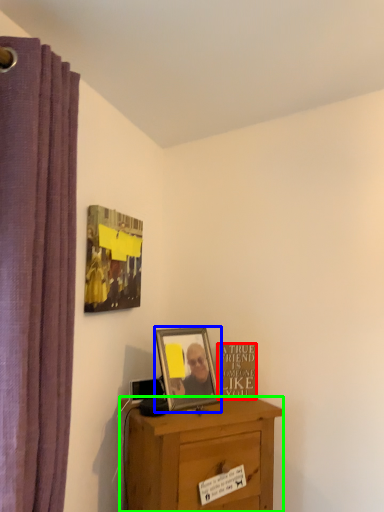
Question: Estimate the real-world distances between objects in this image. Which object is farther from writing (highlighted by a red box), picture frame (highlighted by a blue box) or desk (highlighted by a green box)?

Choices:
 (A) picture frame
 (B) desk

Answer: (B)